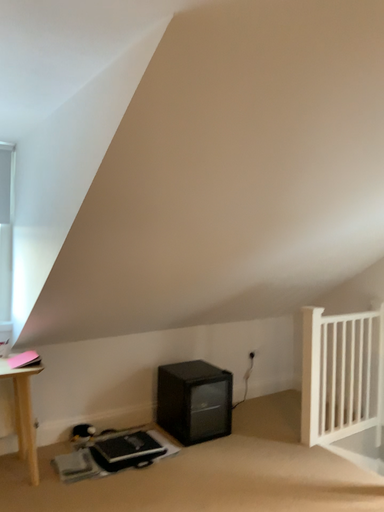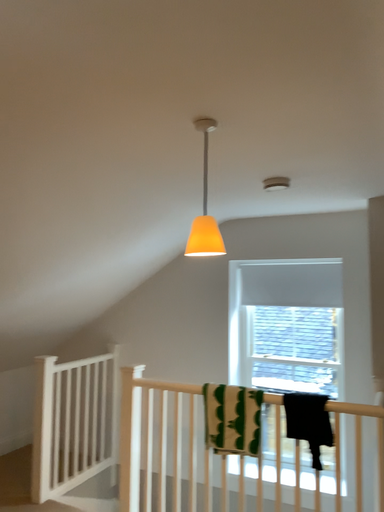
Question: Which way did the camera rotate in the video?

Choices:
 (A) rotated right
 (B) rotated left

Answer: (A)